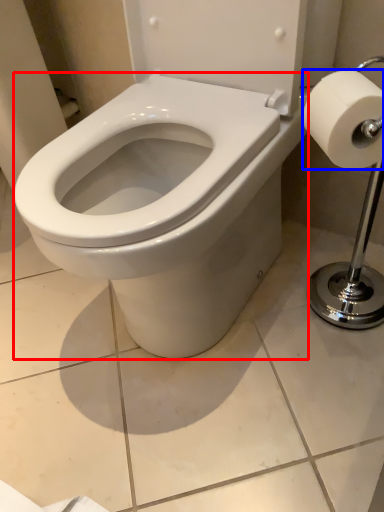
Question: Which object is further to the camera taking this photo, bidet (highlighted by a red box) or toilet paper (highlighted by a blue box)?

Choices:
 (A) bidet
 (B) toilet paper

Answer: (B)